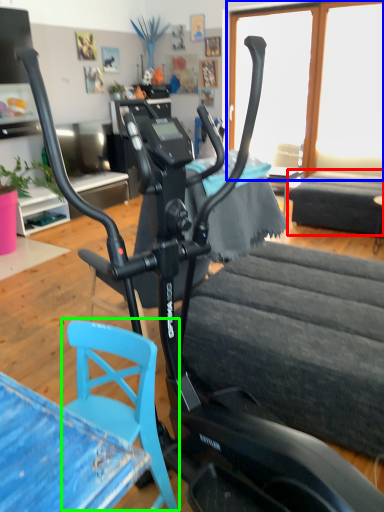
Question: Which object is the closest to the table (highlighted by a red box)? Choose among these: window screen (highlighted by a blue box) or swivel chair (highlighted by a green box).

Choices:
 (A) window screen
 (B) swivel chair

Answer: (A)